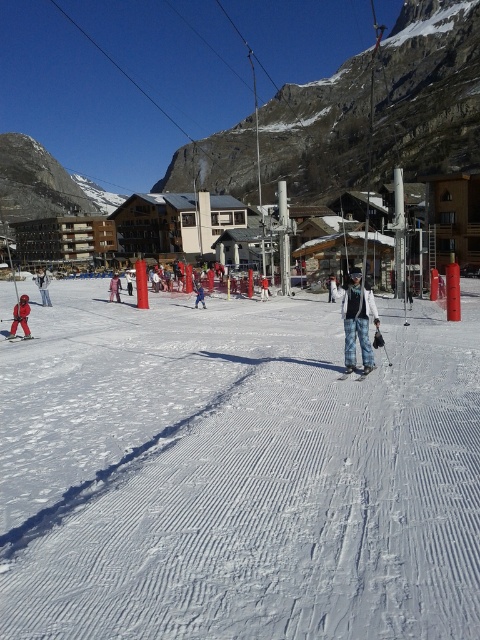
Which is in front, point (362, 371) or point (196, 300)?

Point (362, 371) is more forward.

Does point (369, 369) come closer to viewer compared to point (202, 298)?

Yes, it is.

Is point (373, 368) in front of point (199, 284)?

Yes, it is.

Locate an element on the screen. This screenshot has height=640, width=480. metallic blue ski at center is located at coordinates (364, 372).

Can you confirm if red ski suit at center is taller than matte red ski at lower left?

Indeed, red ski suit at center has a greater height compared to matte red ski at lower left.

Locate an element on the screen. This screenshot has width=480, height=640. red ski suit at center is located at coordinates (264, 288).

At what (x,y) coordinates should I click in order to perform the action: click on red ski suit at center. Please return your answer as a coordinate pair (x, y). Image resolution: width=480 pixels, height=640 pixels. Looking at the image, I should click on (264, 288).

Is red fabric jacket at lower left bigger than metallic blue ski at center?

Correct, red fabric jacket at lower left is larger in size than metallic blue ski at center.

Can you confirm if red fabric jacket at lower left is positioned below metallic blue ski at center?

No, red fabric jacket at lower left is not below metallic blue ski at center.

Which is behind, point (28, 307) or point (352, 372)?

Point (28, 307)

Identify the location of red fabric jacket at lower left. (21, 317).